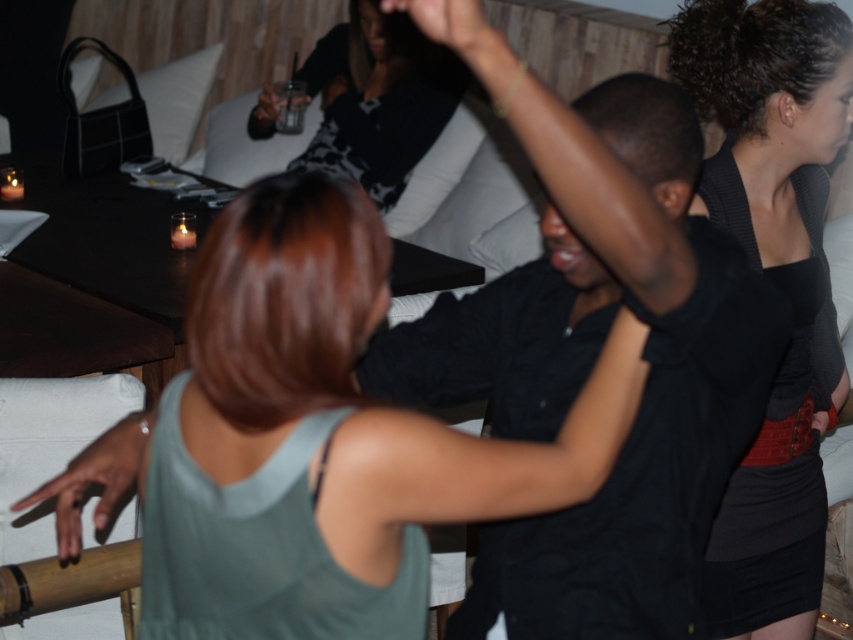
You are at a party and want to take a photo of the black jersey top at upper center and the dark skin hand at lower left. Which object is closer to you?

The black jersey top at upper center is closer to you than the dark skin hand at lower left.

You are at a party and want to move from the point at coordinates point (415, 192) to the point at coordinates point (281, 93). Given that the space between them is clear, will you need to walk forward or backward to reach your destination?

Since point (415, 192) is behind point (281, 93), you will need to walk forward to reach the destination at point (281, 93) from point (415, 192).

You are at a party and want to grab your drink without touching your phone. Which item should you reach for first, the matte black phone at upper center or the clear plastic cup at upper center?

The matte black phone at upper center is in front of the clear plastic cup at upper center, so you should reach for the clear plastic cup at upper center first to avoid touching the phone.